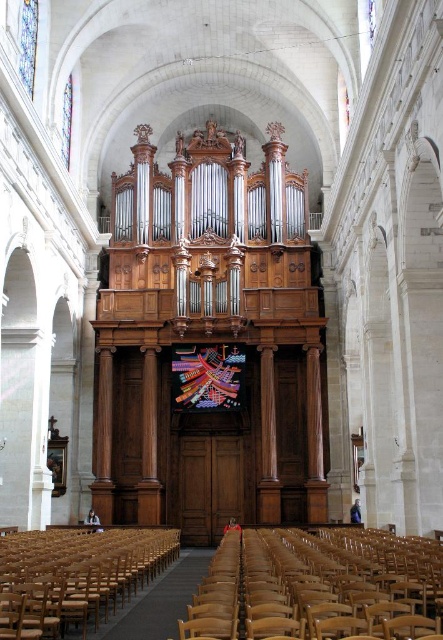
Question: Is light brown wooden chair at lower center wider than wooden chair at lower left?

Choices:
 (A) yes
 (B) no

Answer: (A)

Question: Does light brown wooden chair at lower center have a larger size compared to wooden chair at lower left?

Choices:
 (A) yes
 (B) no

Answer: (A)

Question: Which point appears farthest from the camera in this image?

Choices:
 (A) (31, 548)
 (B) (322, 632)

Answer: (A)

Question: Does light brown wooden chair at lower center have a smaller size compared to wooden chair at lower left?

Choices:
 (A) no
 (B) yes

Answer: (A)